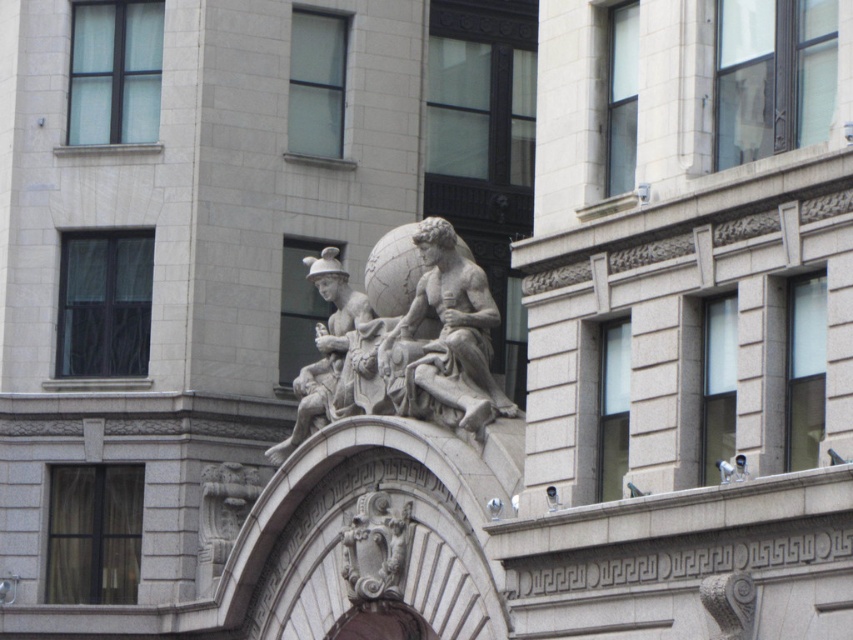
Question: Can you confirm if stone statue at center is positioned above matte stone sculpture at center?

Choices:
 (A) no
 (B) yes

Answer: (B)

Question: Does stone statue at center have a smaller size compared to matte stone sculpture at center?

Choices:
 (A) no
 (B) yes

Answer: (B)

Question: Which of the following is the closest to the observer?

Choices:
 (A) stone statue at center
 (B) matte stone sculpture at center

Answer: (A)

Question: Which of the following is the closest to the observer?

Choices:
 (A) (334, 268)
 (B) (405, 369)

Answer: (B)

Question: Which of the following is the farthest from the observer?

Choices:
 (A) (447, 304)
 (B) (364, 307)

Answer: (B)

Question: Can you confirm if stone statue at center is smaller than matte stone sculpture at center?

Choices:
 (A) yes
 (B) no

Answer: (A)